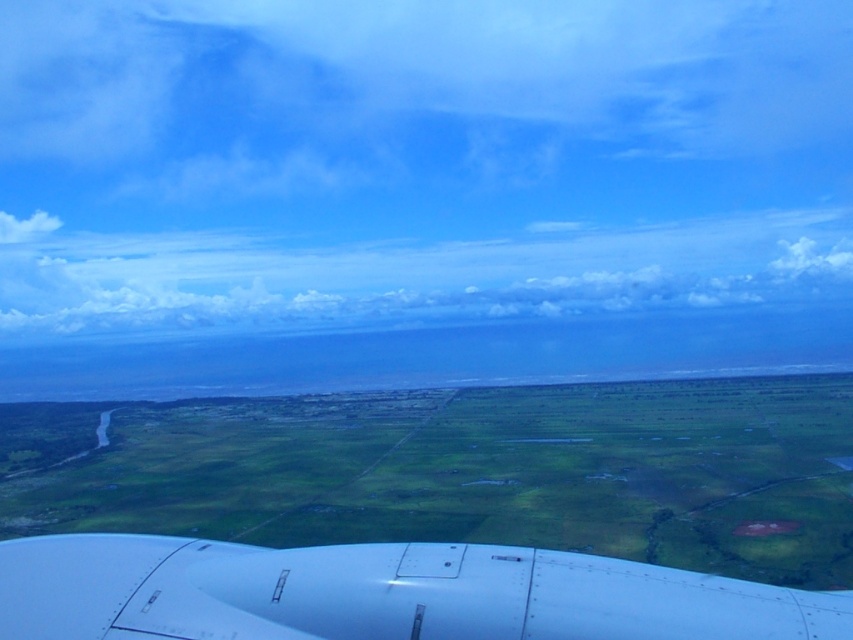
Looking at this image, what is the exact coordinate of the green grassland at center?

The green grassland at center is located at coordinate point (465, 470).

You are a passenger looking out the airplane window. You see the green grassland at center and the white matte airplane wing at bottom. Which object is closer to you?

The green grassland at center is closer to you because the white matte airplane wing at bottom is behind it.

You are a passenger looking out the airplane window. You see the green grassland at center and the cloudy sky at upper center. Which one is closer to your eyes?

The green grassland at center is closer to your eyes because it is in front of the cloudy sky at upper center.